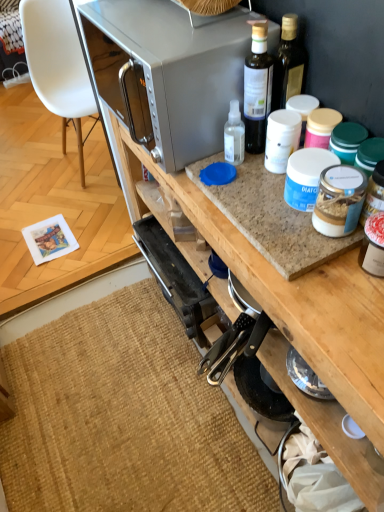
Question: Visually, is translucent plastic bottle at upper center positioned to the left or to the right of burlap mat at lower left?

Choices:
 (A) left
 (B) right

Answer: (B)

Question: From their relative heights in the image, would you say translucent plastic bottle at upper center is taller or shorter than burlap mat at lower left?

Choices:
 (A) tall
 (B) short

Answer: (A)

Question: Which object is the closest to the translucent plastic bottle at upper center?

Choices:
 (A) satin silver microwave at upper center
 (B) white plastic chair at left
 (C) burlap mat at lower left

Answer: (A)

Question: Estimate the real-world distances between objects in this image. Which object is closer to the translucent plastic bottle at upper center?

Choices:
 (A) satin silver microwave at upper center
 (B) burlap mat at lower left
 (C) white plastic chair at left

Answer: (A)